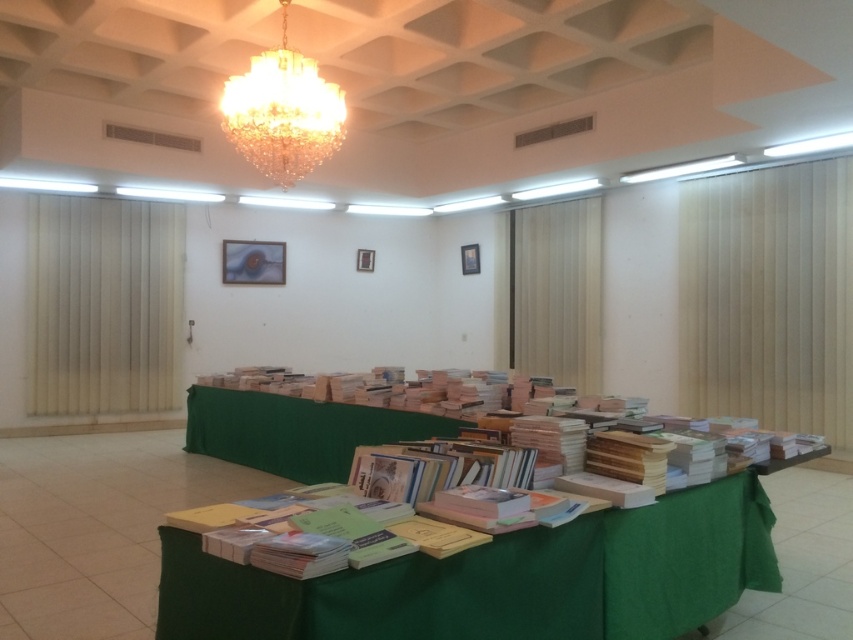
Question: Which object appears closest to the camera in this image?

Choices:
 (A) beige fabric curtain at right
 (B) crystal at upper center
 (C) green fabric-covered table at center
 (D) white/textured curtain at left

Answer: (C)

Question: Which of the following is the closest to the observer?

Choices:
 (A) (650, 620)
 (B) (270, 170)
 (C) (561, 349)

Answer: (A)

Question: Can you confirm if beige fabric curtain at right is positioned below crystal at upper center?

Choices:
 (A) yes
 (B) no

Answer: (A)

Question: In this image, where is beige fabric curtain at right located relative to crystal at upper center?

Choices:
 (A) above
 (B) below

Answer: (B)

Question: Which point is farther from the camera taking this photo?

Choices:
 (A) (158, 365)
 (B) (161, 576)
 (C) (300, 74)
 (D) (834, 212)

Answer: (A)

Question: Is green fabric-covered table at center bigger than beige fabric curtain at right?

Choices:
 (A) no
 (B) yes

Answer: (A)